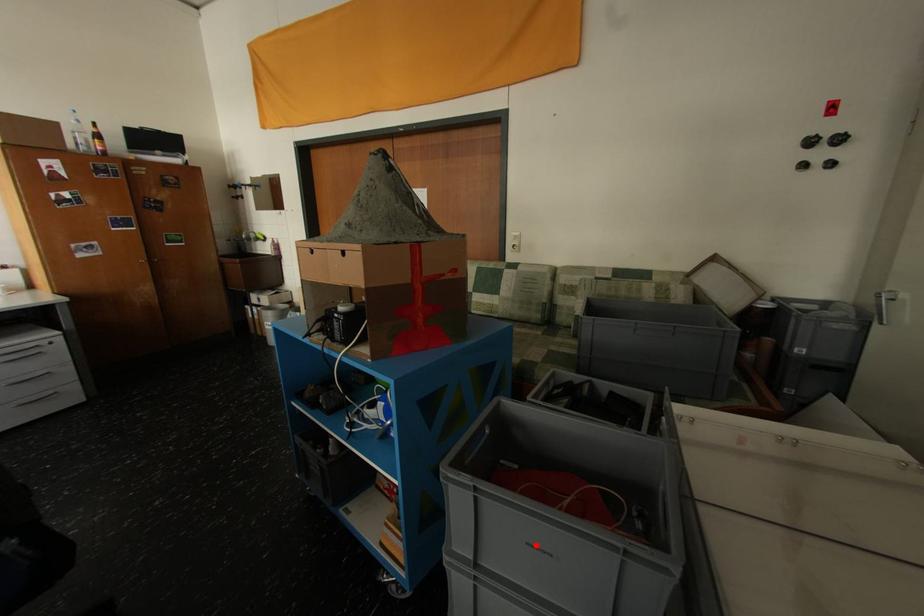
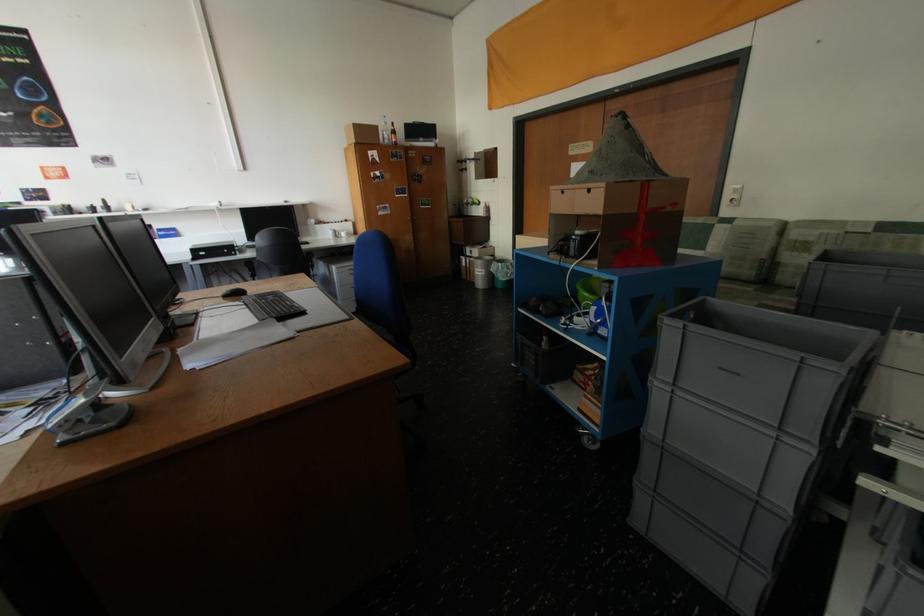
Question: I am providing you with two images of the same scene from different viewpoints. A red point is marked on the first image. Is the red point's position out of view in image 2?

Choices:
 (A) Yes
 (B) No

Answer: (B)